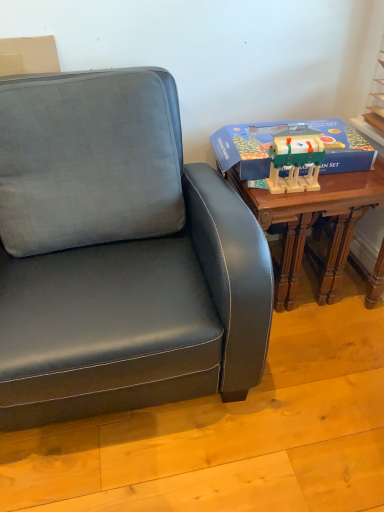
Question: From a real-world perspective, relative to wooden table at right, is blue cardboard box at right vertically above or below?

Choices:
 (A) above
 (B) below

Answer: (A)

Question: In terms of height, does blue cardboard box at right look taller or shorter compared to wooden table at right?

Choices:
 (A) short
 (B) tall

Answer: (A)

Question: Which is farther from the blue cardboard box at right?

Choices:
 (A) wooden christmas train set at right
 (B) wooden table at right

Answer: (B)

Question: Estimate the real-world distances between objects in this image. Which object is farther from the blue cardboard box at right?

Choices:
 (A) wooden table at right
 (B) wooden christmas train set at right

Answer: (A)